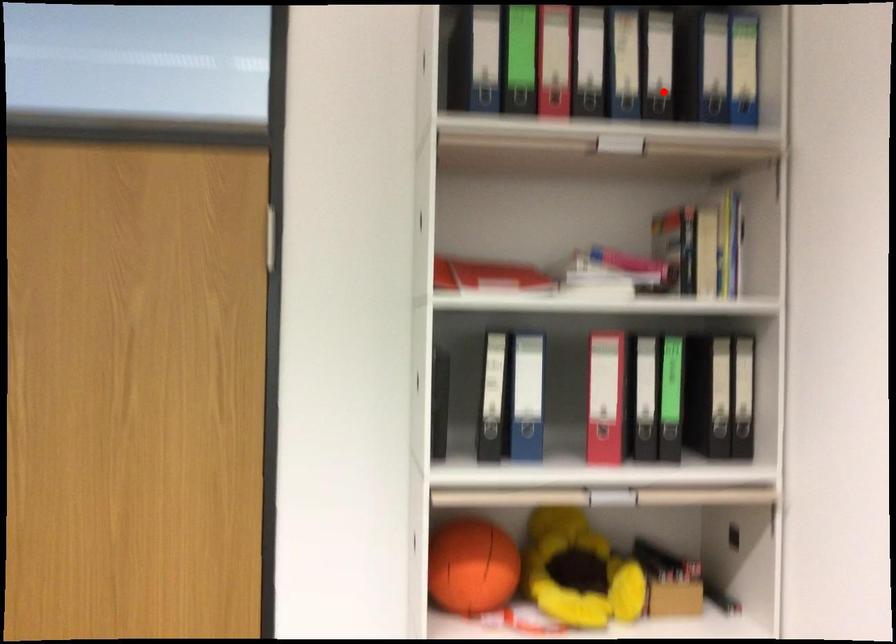
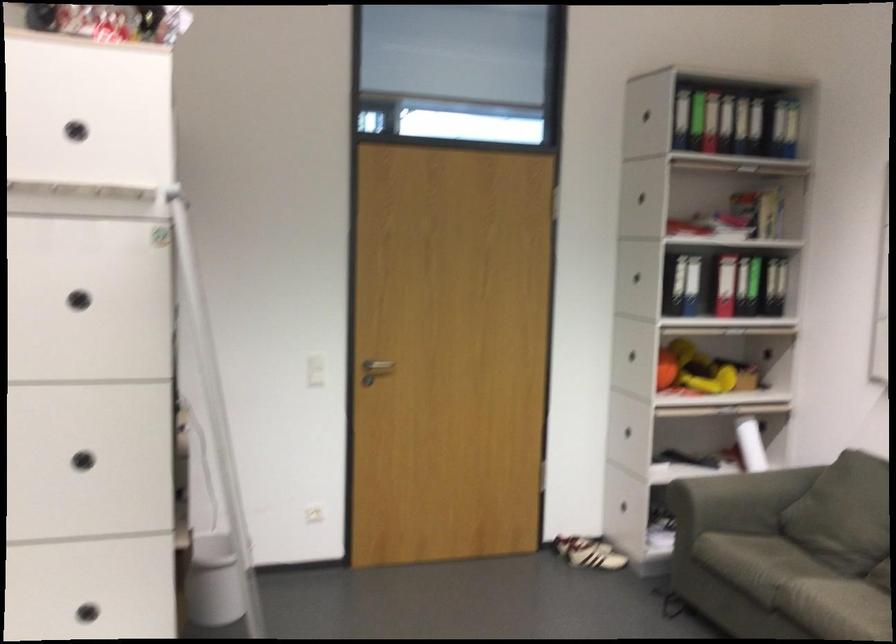
In the second image, find the point that corresponds to the highlighted location in the first image.

(764, 126)